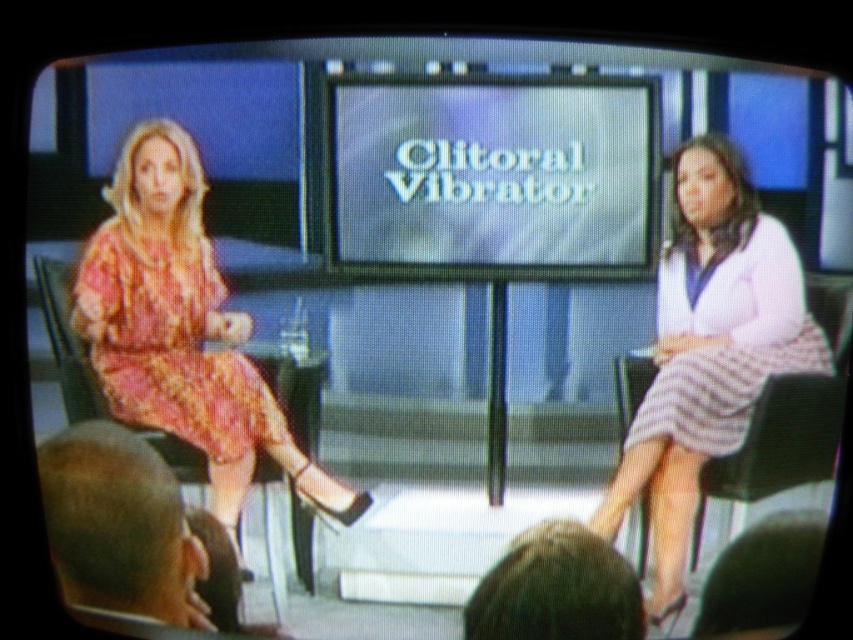
Question: Which point is closer to the camera?

Choices:
 (A) striped fabric skirt at right
 (B) floral dress at left
 (C) printed fabric dress at left
 (D) white striped skirt at right

Answer: (A)

Question: Does printed fabric dress at left come behind white striped skirt at right?

Choices:
 (A) no
 (B) yes

Answer: (B)

Question: Which of the following is the farthest from the observer?

Choices:
 (A) white striped skirt at right
 (B) floral dress at left
 (C) striped fabric skirt at right

Answer: (B)

Question: Does floral dress at left have a lesser width compared to striped fabric skirt at right?

Choices:
 (A) yes
 (B) no

Answer: (B)

Question: From the image, what is the correct spatial relationship of white glossy text at center in relation to floral dress at left?

Choices:
 (A) right
 (B) left

Answer: (A)

Question: Which point is closer to the camera?

Choices:
 (A) (659, 284)
 (B) (180, 236)
 (C) (772, 342)

Answer: (A)